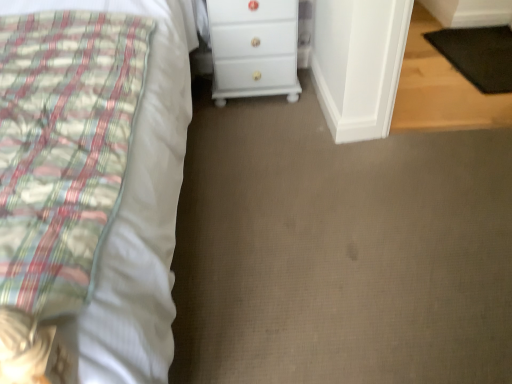
Question: From a real-world perspective, is black rubber mat at lower right over white glossy chest of drawers at center?

Choices:
 (A) yes
 (B) no

Answer: (B)

Question: Is black rubber mat at lower right next to white glossy chest of drawers at center and touching it?

Choices:
 (A) no
 (B) yes

Answer: (A)

Question: From a real-world perspective, is black rubber mat at lower right below white glossy chest of drawers at center?

Choices:
 (A) yes
 (B) no

Answer: (A)

Question: Is black rubber mat at lower right facing towards white glossy chest of drawers at center?

Choices:
 (A) yes
 (B) no

Answer: (B)

Question: From the image's perspective, is black rubber mat at lower right located above white glossy chest of drawers at center?

Choices:
 (A) no
 (B) yes

Answer: (B)

Question: Is white cotton bed at left inside the boundaries of black rubber mat at lower right, or outside?

Choices:
 (A) outside
 (B) inside

Answer: (A)

Question: Considering their positions, is white cotton bed at left located in front of or behind black rubber mat at lower right?

Choices:
 (A) behind
 (B) front

Answer: (B)

Question: From the image's perspective, is white cotton bed at left positioned above or below black rubber mat at lower right?

Choices:
 (A) above
 (B) below

Answer: (B)

Question: Is white cotton bed at left wider or thinner than black rubber mat at lower right?

Choices:
 (A) wide
 (B) thin

Answer: (A)

Question: Is point (480, 51) closer or farther from the camera than point (257, 43)?

Choices:
 (A) closer
 (B) farther

Answer: (B)

Question: Would you say black rubber mat at lower right is to the left or to the right of white glossy chest of drawers at center in the picture?

Choices:
 (A) left
 (B) right

Answer: (B)

Question: From the image's perspective, is black rubber mat at lower right above or below white glossy chest of drawers at center?

Choices:
 (A) above
 (B) below

Answer: (A)

Question: Is black rubber mat at lower right bigger or smaller than white glossy chest of drawers at center?

Choices:
 (A) big
 (B) small

Answer: (B)

Question: Considering the positions of white glossy chest of drawers at center and white cotton bed at left in the image, is white glossy chest of drawers at center bigger or smaller than white cotton bed at left?

Choices:
 (A) big
 (B) small

Answer: (B)

Question: Is white glossy chest of drawers at center wider or thinner than white cotton bed at left?

Choices:
 (A) wide
 (B) thin

Answer: (B)